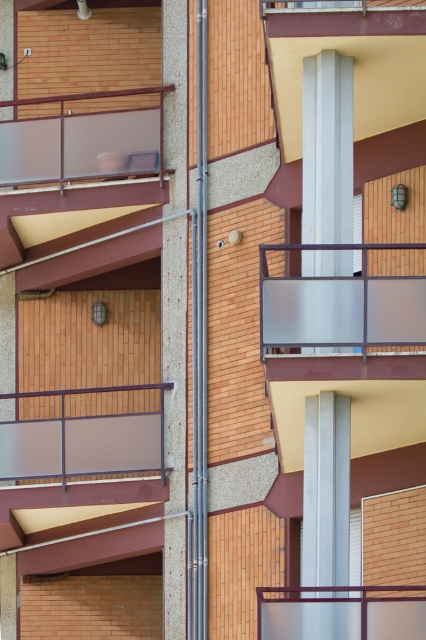
Is frosted glass balustrade at lower center wider than clear glass balcony at upper center?

No, frosted glass balustrade at lower center is not wider than clear glass balcony at upper center.

Between frosted glass balustrade at lower center and clear glass balcony at upper center, which one has less height?

clear glass balcony at upper center is shorter.

Does point (281, 596) come closer to viewer compared to point (298, 33)?

Yes, point (281, 596) is in front of point (298, 33).

This screenshot has height=640, width=426. In order to click on frosted glass balustrade at lower center in this screenshot , I will do `click(340, 612)`.

Which of these two, frosted glass balcony at center or frosted glass balustrade at lower center, stands shorter?

With less height is frosted glass balustrade at lower center.

Between point (370, 248) and point (365, 616), which one is positioned in front?

Point (365, 616)

Locate an element on the screen. The height and width of the screenshot is (640, 426). frosted glass balcony at center is located at coordinates (340, 305).

Is frosted glass balcony at center to the right of matte gray glass balcony at center from the viewer's perspective?

Correct, you'll find frosted glass balcony at center to the right of matte gray glass balcony at center.

Which is above, frosted glass balcony at center or matte gray glass balcony at center?

frosted glass balcony at center is higher up.

Identify the location of frosted glass balcony at center. The image size is (426, 640). (340, 305).

Where is `frosted glass balcony at center`? frosted glass balcony at center is located at coordinates (340, 305).